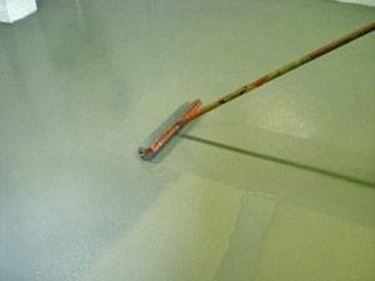
What are the coordinates of `light reflection just below handle` in the screenshot? It's located at (275, 122).